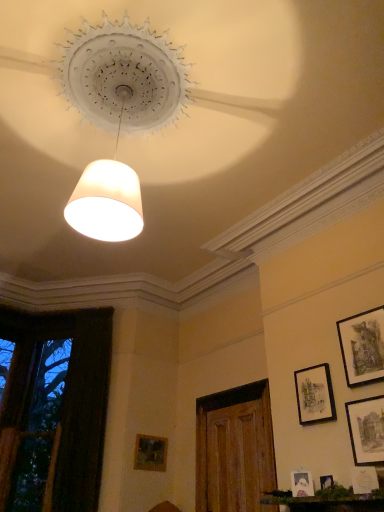
Question: Is matte black picture frame at lower right, positioned as the 3th picture frame in left-to-right order, taller than matte black picture frame at lower right, acting as the 4th picture frame starting from the left?

Choices:
 (A) no
 (B) yes

Answer: (A)

Question: Is matte black picture frame at lower right, positioned as the 3th picture frame in left-to-right order, positioned before matte black picture frame at lower right, acting as the sixth picture frame starting from the front?

Choices:
 (A) no
 (B) yes

Answer: (B)

Question: Is matte black picture frame at lower right, which ranks as the fifth picture frame in front-to-back order, shorter than matte black picture frame at lower right, acting as the 4th picture frame starting from the left?

Choices:
 (A) no
 (B) yes

Answer: (B)

Question: Is matte black picture frame at lower right, which is the 4th picture frame in right-to-left order, completely or partially inside matte black picture frame at lower right, acting as the fifth picture frame starting from the right?

Choices:
 (A) yes
 (B) no

Answer: (B)

Question: Does matte black picture frame at lower right, the 3th picture frame positioned from the back, have a smaller size compared to matte black picture frame at lower right, acting as the sixth picture frame starting from the front?

Choices:
 (A) yes
 (B) no

Answer: (A)

Question: Are matte black picture frame at lower right, which ranks as the fifth picture frame in front-to-back order, and matte black picture frame at lower right, acting as the sixth picture frame starting from the front, making contact?

Choices:
 (A) yes
 (B) no

Answer: (B)

Question: Does wooden door at center have a larger size compared to matte black picture frame at lower right, acting as the 4th picture frame starting from the left?

Choices:
 (A) no
 (B) yes

Answer: (B)

Question: Is wooden door at center outside of matte black picture frame at lower right, acting as the sixth picture frame starting from the front?

Choices:
 (A) no
 (B) yes

Answer: (B)

Question: Does wooden door at center come in front of matte black picture frame at lower right, which is counted as the second picture frame, starting from the back?

Choices:
 (A) no
 (B) yes

Answer: (A)

Question: Is wooden door at center far from matte black picture frame at lower right, which is counted as the second picture frame, starting from the back?

Choices:
 (A) no
 (B) yes

Answer: (B)

Question: From the image's perspective, is wooden door at center below matte black picture frame at lower right, acting as the sixth picture frame starting from the front?

Choices:
 (A) yes
 (B) no

Answer: (A)

Question: From the image's perspective, is wooden door at center over matte black picture frame at lower right, acting as the 4th picture frame starting from the left?

Choices:
 (A) yes
 (B) no

Answer: (B)

Question: From the image's perspective, is matte black picture frame at lower right, which is counted as the second picture frame, starting from the back, under matte white picture frame at lower right, arranged as the 5th picture frame when viewed from the back?

Choices:
 (A) yes
 (B) no

Answer: (B)